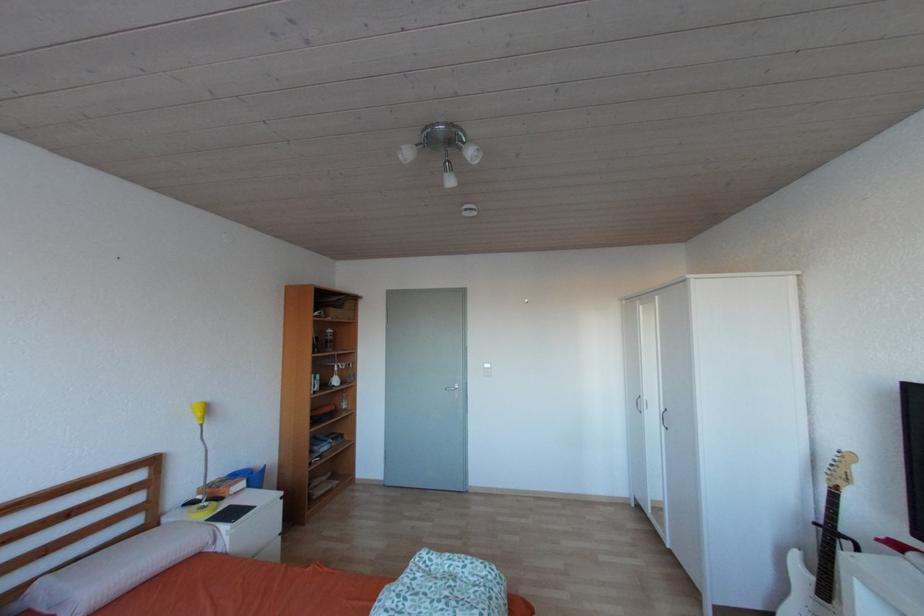
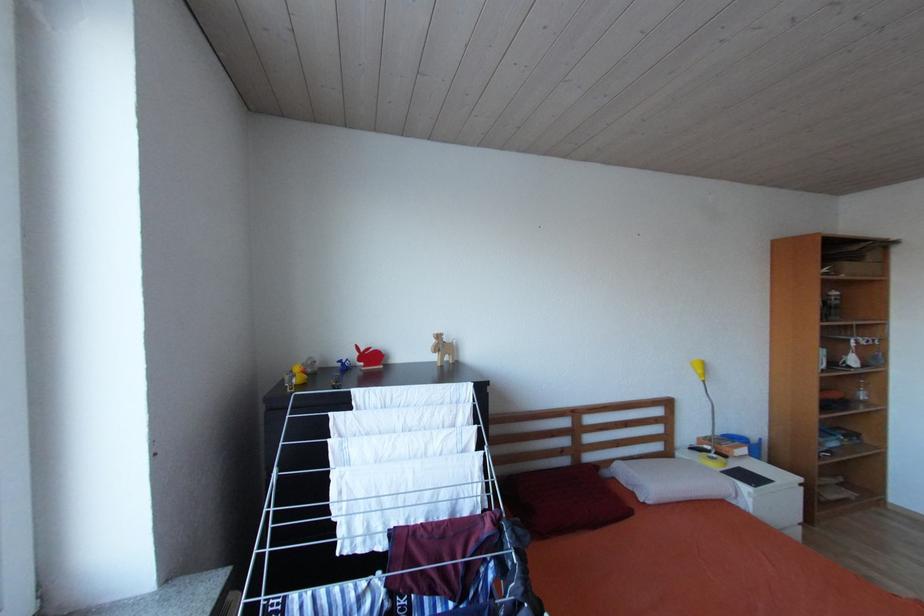
Question: How did the camera likely rotate?

Choices:
 (A) Left
 (B) Right
 (C) Up
 (D) Down

Answer: (A)